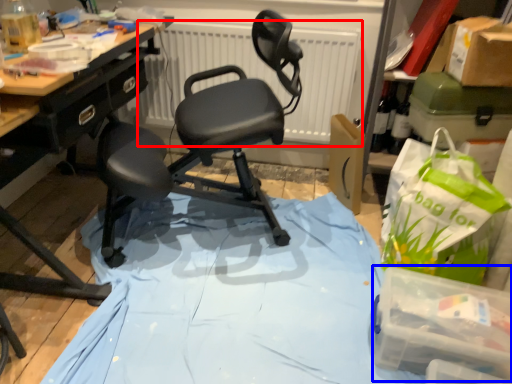
Question: Among these objects, which one is nearest to the camera, radiator (highlighted by a red box) or box (highlighted by a blue box)?

Choices:
 (A) radiator
 (B) box

Answer: (B)